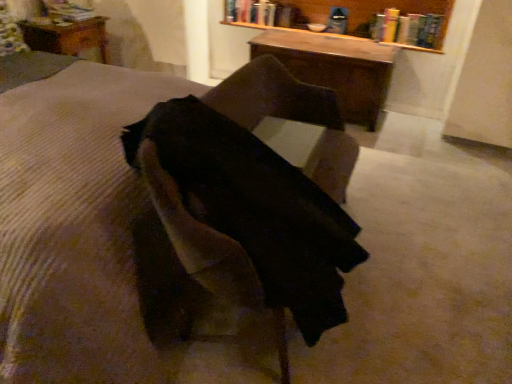
Question: Is suede-like brown chair at center looking in the opposite direction of hardcover book at upper center, which ranks as the second book in left-to-right order?

Choices:
 (A) no
 (B) yes

Answer: (A)

Question: Considering the relative sizes of suede-like brown chair at center and hardcover book at upper center, arranged as the 2th book when viewed from the right, in the image provided, is suede-like brown chair at center thinner than hardcover book at upper center, arranged as the 2th book when viewed from the right,?

Choices:
 (A) no
 (B) yes

Answer: (A)

Question: Considering the relative sizes of suede-like brown chair at center and hardcover book at upper center, which ranks as the second book in left-to-right order, in the image provided, is suede-like brown chair at center smaller than hardcover book at upper center, which ranks as the second book in left-to-right order,?

Choices:
 (A) no
 (B) yes

Answer: (A)

Question: Can we say suede-like brown chair at center lies outside hardcover book at upper center, arranged as the 2th book when viewed from the right?

Choices:
 (A) no
 (B) yes

Answer: (B)

Question: Is suede-like brown chair at center shorter than hardcover book at upper center, which ranks as the second book in left-to-right order?

Choices:
 (A) yes
 (B) no

Answer: (B)

Question: Considering the positions of hardcover book at upper center, arranged as the 2th book when viewed from the right, and brown corduroy mattress at center in the image, is hardcover book at upper center, arranged as the 2th book when viewed from the right, wider or thinner than brown corduroy mattress at center?

Choices:
 (A) thin
 (B) wide

Answer: (A)

Question: From a real-world perspective, is hardcover book at upper center, which ranks as the second book in left-to-right order, above or below brown corduroy mattress at center?

Choices:
 (A) above
 (B) below

Answer: (A)

Question: In terms of size, does hardcover book at upper center, arranged as the 2th book when viewed from the right, appear bigger or smaller than brown corduroy mattress at center?

Choices:
 (A) small
 (B) big

Answer: (A)

Question: Considering the positions of hardcover book at upper center, which ranks as the second book in left-to-right order, and brown corduroy mattress at center in the image, is hardcover book at upper center, which ranks as the second book in left-to-right order, taller or shorter than brown corduroy mattress at center?

Choices:
 (A) tall
 (B) short

Answer: (B)

Question: Relative to suede-like brown chair at center, is wooden table at center, which is the 2th table in front-to-back order, in front or behind?

Choices:
 (A) front
 (B) behind

Answer: (B)

Question: Is point (365, 94) closer or farther from the camera than point (330, 213)?

Choices:
 (A) farther
 (B) closer

Answer: (A)

Question: In terms of size, does wooden table at center, which is the 2th table in front-to-back order, appear bigger or smaller than suede-like brown chair at center?

Choices:
 (A) big
 (B) small

Answer: (B)

Question: From the image's perspective, relative to suede-like brown chair at center, is wooden table at center, which is counted as the 3th table, starting from the left, above or below?

Choices:
 (A) above
 (B) below

Answer: (A)

Question: Considering the positions of point [x=306, y=225] and point [x=37, y=29], is point [x=306, y=225] closer or farther from the camera than point [x=37, y=29]?

Choices:
 (A) closer
 (B) farther

Answer: (A)

Question: From the image's perspective, is suede-like brown chair at center located above or below wooden table at upper left, marked as the 3th table in a right-to-left arrangement?

Choices:
 (A) below
 (B) above

Answer: (A)